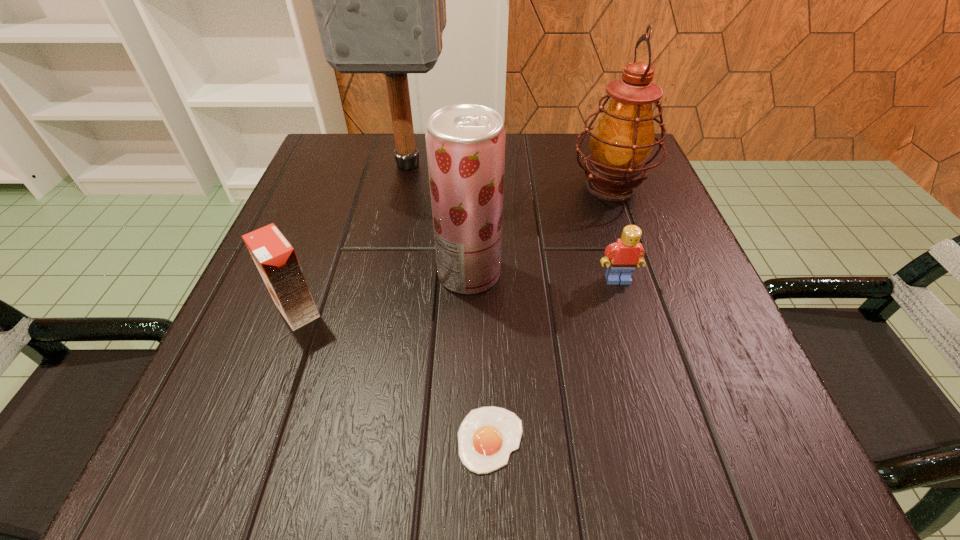
What are the coordinates of `free space that satisfies the following two spatial constraints: 1. on the striking surface of the oil lamp; 2. on the left side of the mallet` in the screenshot? It's located at (403, 186).

The image size is (960, 540). I want to click on free space in the image that satisfies the following two spatial constraints: 1. on the back side of the fruit juice; 2. on the right side of the oil lamp, so click(x=471, y=186).

You are a GUI agent. You are given a task and a screenshot of the screen. Output one action in this format:
    pyautogui.click(x=<x>, y=<y>)
    Task: Click on the vacant point that satisfies the following two spatial constraints: 1. on the front side of the orange juice; 2. on the right side of the nearest object
    The width and height of the screenshot is (960, 540).
    Given the screenshot: What is the action you would take?
    pyautogui.click(x=250, y=439)

Where is `vacant space that satisfies the following two spatial constraints: 1. on the striking surface of the oil lamp; 2. on the left side of the mallet`? vacant space that satisfies the following two spatial constraints: 1. on the striking surface of the oil lamp; 2. on the left side of the mallet is located at coordinates (403, 186).